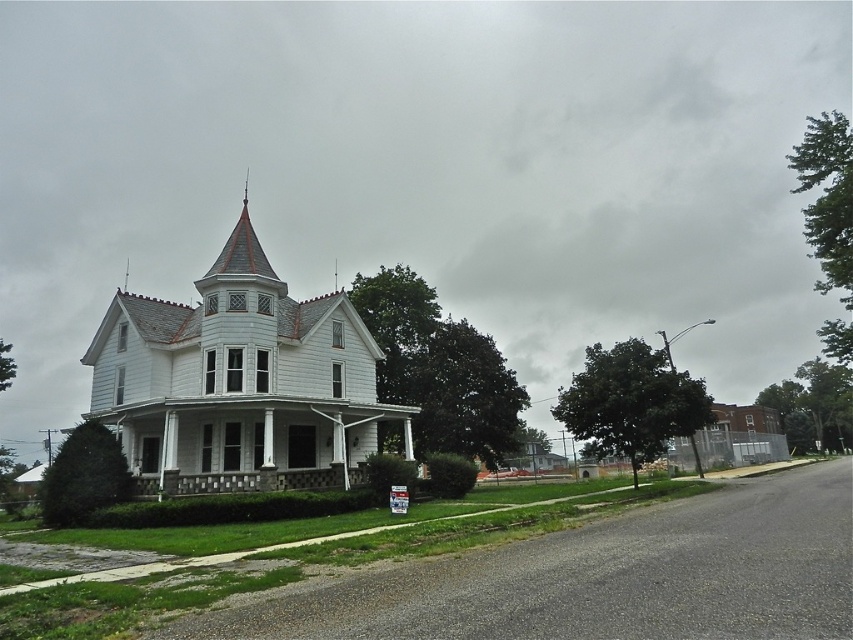
Consider the image. Is white painted wood porch at center above gray stone porch at lower center?

Incorrect, white painted wood porch at center is not positioned above gray stone porch at lower center.

Consider the image. Does white painted wood porch at center have a larger size compared to gray stone porch at lower center?

Yes.

I want to click on white painted wood porch at center, so click(273, 458).

Locate an element on the screen. The width and height of the screenshot is (853, 640). white painted wood porch at center is located at coordinates (273, 458).

Which is in front, point (225, 440) or point (107, 412)?

Point (225, 440) is in front.

Image resolution: width=853 pixels, height=640 pixels. I want to click on white shingles at upper center, so click(x=238, y=378).

Identify the location of white shingles at upper center. (238, 378).

Does point (148, 436) come closer to viewer compared to point (289, 477)?

No, (148, 436) is further to viewer.

Where is `white shingles at upper center`? The width and height of the screenshot is (853, 640). white shingles at upper center is located at coordinates (238, 378).